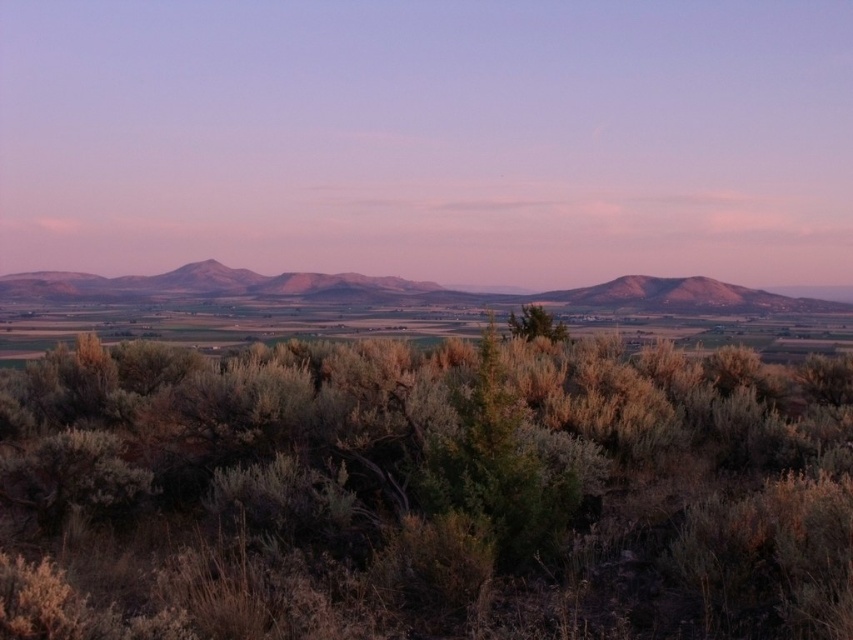
You are standing in the landscape scene and want to place a small statue between the green shrubbery at center and the green leafy bush at center. Based on their positions, which object should the statue be closer to?

The green shrubbery at center is positioned under the green leafy bush at center, so the statue should be placed closer to the green shrubbery at center to avoid being obscured by the bush.

You are standing in the foreground of the scene and want to take a photo of the rustic brown mountains at center. Which direction should you move to get them into the frame?

The rustic brown mountains at center are already in the center of the scene, so you don not need to move. Just aim your camera towards the center to capture them.